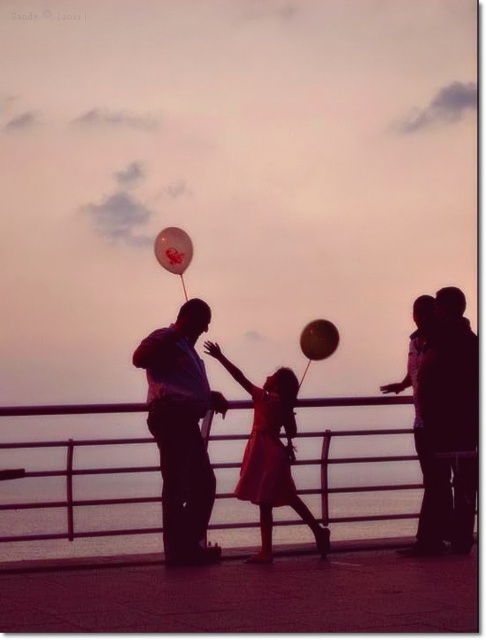
Question: Estimate the real-world distances between objects in this image. Which object is farther from the matte red dress at center?

Choices:
 (A) translucent pink balloon at center
 (B) matte black shirt at center

Answer: (A)

Question: Which point is farther to the camera?

Choices:
 (A) (320, 356)
 (B) (183, 355)
 (C) (177, 269)

Answer: (A)

Question: Does matte black dress at center appear under metallic silver rail at center?

Choices:
 (A) yes
 (B) no

Answer: (B)

Question: From the image, what is the correct spatial relationship of matte black dress at center in relation to translucent plastic balloon at center?

Choices:
 (A) below
 (B) above

Answer: (A)

Question: Among these points, which one is farthest from the camera?

Choices:
 (A) (328, 326)
 (B) (174, 259)
 (C) (240, 435)
 (D) (193, 429)

Answer: (B)

Question: In this image, where is metallic silver rail at center located relative to matte red dress at center?

Choices:
 (A) right
 (B) left

Answer: (B)